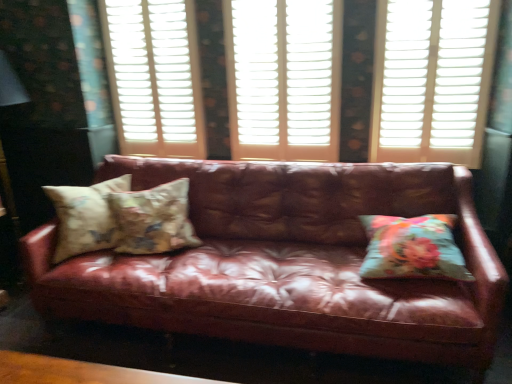
Question: Is point (185, 125) positioned closer to the camera than point (323, 301)?

Choices:
 (A) farther
 (B) closer

Answer: (A)

Question: From the image's perspective, relative to leather couch at center, is white plastic shutters at center, acting as the 1th window frame starting from the left, above or below?

Choices:
 (A) below
 (B) above

Answer: (B)

Question: Which of these objects is positioned closest to the white wood window frame at center, the 2th window frame viewed from the left?

Choices:
 (A) white plastic shutters at center, which ranks as the 2th window frame in right-to-left order
 (B) leather couch at center
 (C) floral fabric pillow at right, which ranks as the first pillow in right-to-left order
 (D) floral fabric pillow at center, the 2th pillow when ordered from right to left
 (E) white plastic shutters at upper center

Answer: (A)

Question: Based on their relative distances, which object is farther from the floral fabric pillow at right, the third pillow in the left-to-right sequence?

Choices:
 (A) white plastic shutters at upper center
 (B) floral fabric cushion at center, which ranks as the 1th pillow in left-to-right order
 (C) white plastic shutters at center, acting as the 1th window frame starting from the left
 (D) floral fabric pillow at center, placed as the 2th pillow when sorted from left to right
 (E) leather couch at center

Answer: (C)